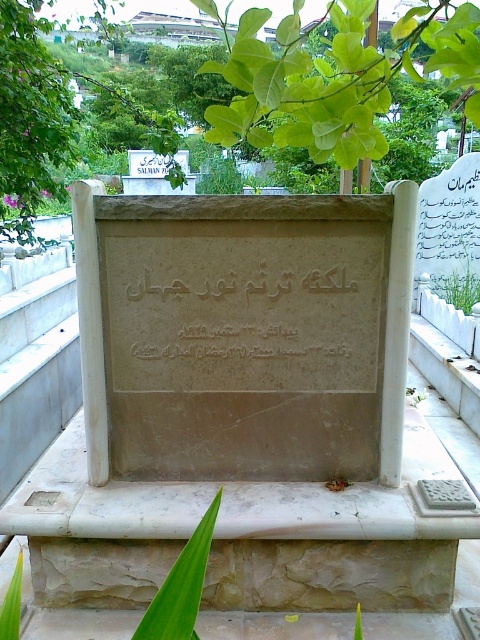
Based on the scene description, where is the matte stone inscription at center located in terms of its 2D coordinates?

The matte stone inscription at center is located at coordinates point (240, 310).